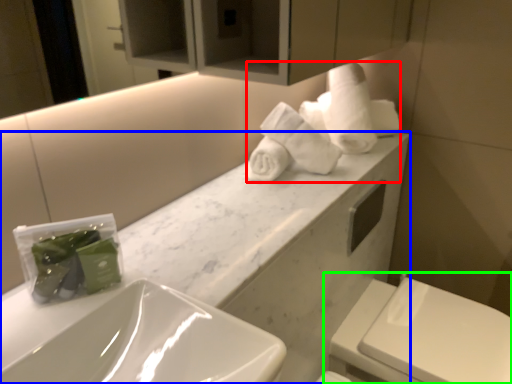
Question: Which is nearer to the bath towel (highlighted by a red box)? porcelain (highlighted by a blue box) or toilet (highlighted by a green box).

Choices:
 (A) porcelain
 (B) toilet

Answer: (A)